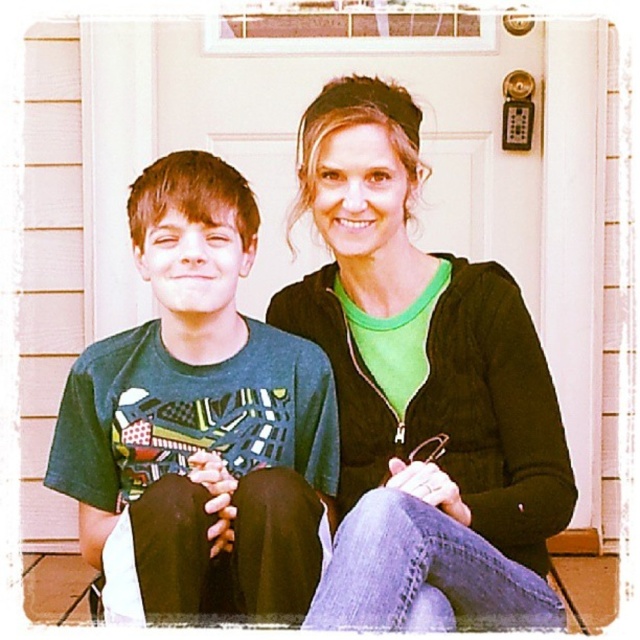
In the scene shown: You are trying to decide which green item to take with you for a chilly evening. Both the green matte jacket at center and the green matte shirt at center are available. Based on their sizes, which one would you choose to wear for better warmth?

The green matte jacket at center is larger in size than the green matte shirt at center, so it would provide better warmth and coverage, making it the better choice.

You are a tailor measuring two green items in the image. The first is the green matte jacket at center and the second is the green matte shirt at center. The customer wants to know if these two items can be hung side by side on a 24 inch wide hanger. Can they fit?

The distance between the green matte jacket at center and green matte shirt at center is 12.54 inches, so yes, they can be hung side by side on a 24 inch wide hanger since the combined width would be less than 24 inches.